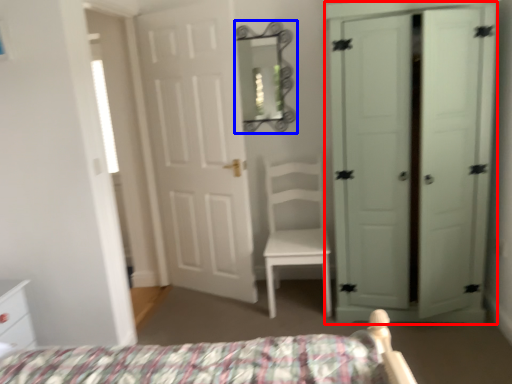
Question: Which object appears closest to the camera in this image, door (highlighted by a red box) or mirror (highlighted by a blue box)?

Choices:
 (A) door
 (B) mirror

Answer: (A)